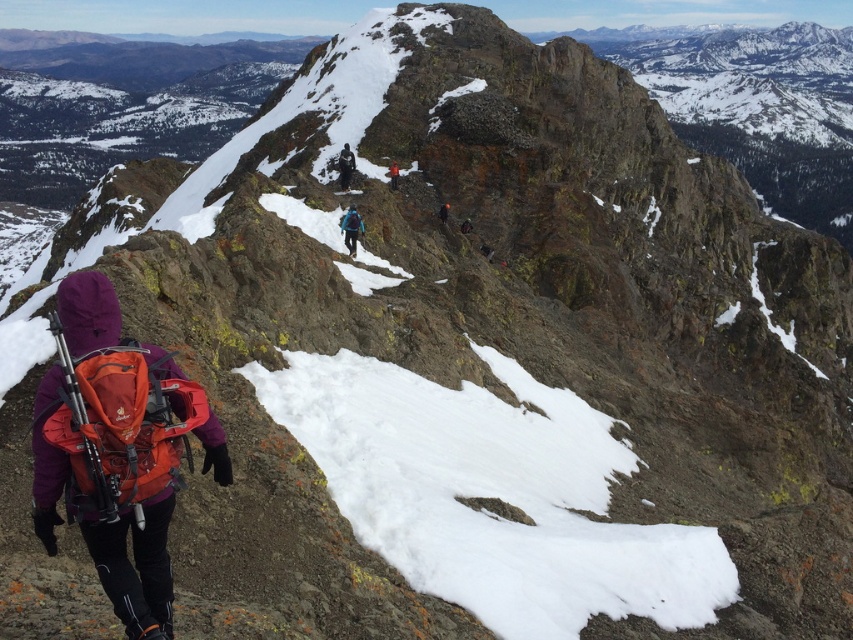
Is orange fabric backpack at lower left wider than dark blue jacket at center?

Yes, orange fabric backpack at lower left is wider than dark blue jacket at center.

Is point (113, 317) behind point (341, 170)?

No, (113, 317) is in front of (341, 170).

Does point (51, 518) lie behind point (352, 168)?

No, (51, 518) is in front of (352, 168).

Locate an element on the screen. Image resolution: width=853 pixels, height=640 pixels. orange fabric backpack at lower left is located at coordinates (137, 561).

From the picture: Measure the distance from orange fabric jacket at center to matte blue jacket at center.

orange fabric jacket at center is 9.15 meters away from matte blue jacket at center.

Is point (390, 177) more distant than point (461, 230)?

Yes, it is.

Describe the element at coordinates (393, 173) in the screenshot. I see `orange fabric jacket at center` at that location.

This screenshot has width=853, height=640. Identify the location of orange fabric jacket at center. (393, 173).

Who is more forward, (354, 232) or (393, 170)?

Point (354, 232)

Does blue fabric backpack at center have a greater height compared to orange fabric jacket at center?

No.

Who is more distant from viewer, (347, 230) or (393, 172)?

The point (393, 172) is more distant.

The width and height of the screenshot is (853, 640). Identify the location of blue fabric backpack at center. (351, 228).